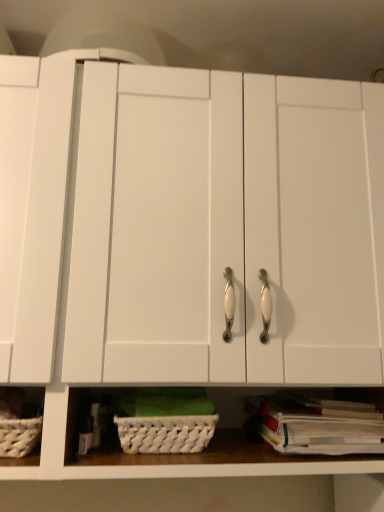
Question: Is white woven basket at lower center inside the boundaries of white paper book at lower right, or outside?

Choices:
 (A) outside
 (B) inside

Answer: (A)

Question: Does point (129, 432) appear closer or farther from the camera than point (288, 397)?

Choices:
 (A) closer
 (B) farther

Answer: (A)

Question: Considering the relative positions of white woven basket at lower center and white paper book at lower right in the image provided, is white woven basket at lower center to the left or to the right of white paper book at lower right?

Choices:
 (A) right
 (B) left

Answer: (B)

Question: Based on their positions, is white paper book at lower right located to the left or right of white woven basket at lower center?

Choices:
 (A) left
 (B) right

Answer: (B)

Question: Considering the positions of white paper book at lower right and white woven basket at lower center in the image, is white paper book at lower right taller or shorter than white woven basket at lower center?

Choices:
 (A) short
 (B) tall

Answer: (A)

Question: Relative to white woven basket at lower center, is white paper book at lower right in front or behind?

Choices:
 (A) behind
 (B) front

Answer: (B)

Question: Would you say white paper book at lower right is inside or outside white woven basket at lower center?

Choices:
 (A) inside
 (B) outside

Answer: (B)